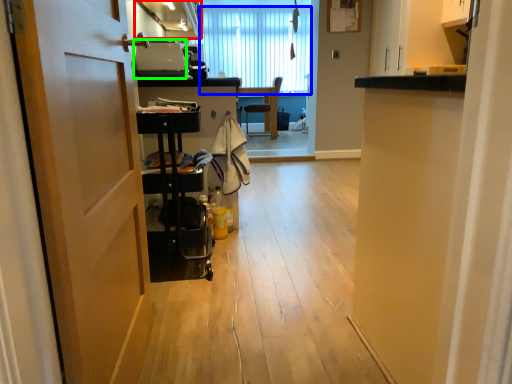
Question: Which is farther away from cabinetry (highlighted by a red box)? curtain (highlighted by a blue box) or appliance (highlighted by a green box)?

Choices:
 (A) curtain
 (B) appliance

Answer: (A)